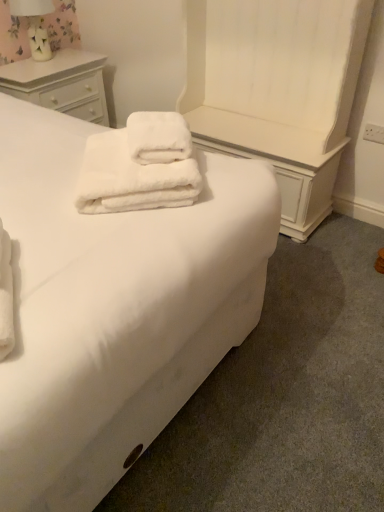
Describe the element at coordinates (35, 25) in the screenshot. I see `floral fabric lampshade at upper left` at that location.

Locate an element on the screen. The height and width of the screenshot is (512, 384). floral fabric lampshade at upper left is located at coordinates point(35,25).

At what (x,y) coordinates should I click in order to perform the action: click on white soft bed at center. Please return your answer as a coordinate pair (x, y). The width and height of the screenshot is (384, 512). Looking at the image, I should click on (114, 308).

Looking at this image, considering the relative positions of white fluffy towels at center and white soft bed at center in the image provided, is white fluffy towels at center to the left or to the right of white soft bed at center?

From the image, it's evident that white fluffy towels at center is to the right of white soft bed at center.

From the image's perspective, which object appears higher, white fluffy towels at center or white soft bed at center?

white fluffy towels at center.

Is white fluffy towels at center looking in the opposite direction of white soft bed at center?

Yes.

From a real-world perspective, is white fluffy towels at center physically located above or below white soft bed at center?

Clearly, from a real-world perspective, white fluffy towels at center is above white soft bed at center.

Can you confirm if white fluffy towels at center is positioned to the left of floral fabric lampshade at upper left?

No.

In the scene shown: Considering the sizes of objects white fluffy towels at center and floral fabric lampshade at upper left in the image provided, who is shorter, white fluffy towels at center or floral fabric lampshade at upper left?

With less height is white fluffy towels at center.

Between white fluffy towels at center and floral fabric lampshade at upper left, which one has larger size?

Bigger between the two is white fluffy towels at center.

Which is behind, white fluffy towels at center or floral fabric lampshade at upper left?

floral fabric lampshade at upper left is further away from the camera.

In the scene shown: Which is behind, white soft bed at center or floral fabric lampshade at upper left?

Positioned behind is floral fabric lampshade at upper left.

Considering the sizes of objects white soft bed at center and floral fabric lampshade at upper left in the image provided, who is bigger, white soft bed at center or floral fabric lampshade at upper left?

white soft bed at center is bigger.

Can you confirm if white soft bed at center is shorter than floral fabric lampshade at upper left?

No, white soft bed at center is not shorter than floral fabric lampshade at upper left.

Is floral fabric lampshade at upper left surrounded by white soft bed at center?

No, floral fabric lampshade at upper left is not inside white soft bed at center.

Is floral fabric lampshade at upper left facing towards white soft bed at center?

No, floral fabric lampshade at upper left is not turned towards white soft bed at center.

Which is nearer, (x=31, y=4) or (x=113, y=219)?

Point (x=31, y=4) is positioned farther from the camera compared to point (x=113, y=219).

From a real-world perspective, is floral fabric lampshade at upper left on white soft bed at center?

Yes, from a real-world perspective, floral fabric lampshade at upper left is above white soft bed at center.

Is floral fabric lampshade at upper left shorter than white soft bed at center?

Correct, floral fabric lampshade at upper left is not as tall as white soft bed at center.

Is white wood chest of drawers at upper left aimed at white soft bed at center?

No, white wood chest of drawers at upper left is not facing towards white soft bed at center.

Which is correct: white wood chest of drawers at upper left is inside white soft bed at center, or outside of it?

white wood chest of drawers at upper left is outside white soft bed at center.

Is point (67, 112) more distant than point (213, 222)?

Yes.

Locate an element on the screen. The image size is (384, 512). bed above the white wood chest of drawers at upper left (from a real-world perspective) is located at coordinates (114, 308).

Considering the relative positions of white soft bed at center and white fluffy towels at center in the image provided, is white soft bed at center behind white fluffy towels at center?

No, white soft bed at center is in front of white fluffy towels at center.

Is white soft bed at center touching white fluffy towels at center?

No, white soft bed at center is not making contact with white fluffy towels at center.

Based on the photo, from a real-world perspective, is white soft bed at center under white fluffy towels at center?

Yes, from a real-world perspective, white soft bed at center is below white fluffy towels at center.

Is white soft bed at center smaller than white fluffy towels at center?

No.

Is white wood chest of drawers at upper left further to the viewer compared to floral fabric lampshade at upper left?

No, the depth of white wood chest of drawers at upper left is less than that of floral fabric lampshade at upper left.

Which object is positioned more to the left, white wood chest of drawers at upper left or floral fabric lampshade at upper left?

floral fabric lampshade at upper left.

From a real-world perspective, between white wood chest of drawers at upper left and floral fabric lampshade at upper left, who is vertically lower?

white wood chest of drawers at upper left is physically lower.

Is white wood chest of drawers at upper left turned away from floral fabric lampshade at upper left?

No, white wood chest of drawers at upper left is not facing the opposite direction of floral fabric lampshade at upper left.

Identify the location of towel that appears behind the white soft bed at center. (131, 179).

Find the location of a particular element. bedside lamp that is above the white fluffy towels at center (from the image's perspective) is located at coordinates (35, 25).

From the image, which object appears to be nearer to white wood chest of drawers at upper left, floral fabric lampshade at upper left or white soft bed at center?

floral fabric lampshade at upper left.

Which object lies nearer to the anchor point floral fabric lampshade at upper left, white fluffy towels at center or white soft bed at center?

white fluffy towels at center.

Considering their positions, is white soft bed at center positioned further to white fluffy towels at center than white wood chest of drawers at upper left?

white wood chest of drawers at upper left lies further to white fluffy towels at center than the other object.

Looking at this image, considering their positions, is floral fabric lampshade at upper left positioned closer to white soft bed at center than white wood chest of drawers at upper left?

white wood chest of drawers at upper left is positioned closer to the anchor white soft bed at center.

Looking at this image, when comparing their distances from white fluffy towels at center, does floral fabric lampshade at upper left or white soft bed at center seem further?

floral fabric lampshade at upper left is positioned further to the anchor white fluffy towels at center.

Estimate the real-world distances between objects in this image. Which object is closer to white wood chest of drawers at upper left, white fluffy towels at center or white soft bed at center?

white soft bed at center lies closer to white wood chest of drawers at upper left than the other object.

Considering their positions, is white soft bed at center positioned closer to white wood chest of drawers at upper left than white fluffy towels at center?

white soft bed at center is closer to white wood chest of drawers at upper left.

Considering their positions, is floral fabric lampshade at upper left positioned closer to white fluffy towels at center than white wood chest of drawers at upper left?

white wood chest of drawers at upper left is positioned closer to the anchor white fluffy towels at center.

This screenshot has width=384, height=512. Find the location of `towel between white soft bed at center and white wood chest of drawers at upper left from front to back`. towel between white soft bed at center and white wood chest of drawers at upper left from front to back is located at coordinates (131, 179).

Where is `chest of drawers between white fluffy towels at center and floral fabric lampshade at upper left along the z-axis`? The image size is (384, 512). chest of drawers between white fluffy towels at center and floral fabric lampshade at upper left along the z-axis is located at coordinates (61, 83).

Locate an element on the screen. This screenshot has height=512, width=384. towel between white soft bed at center and floral fabric lampshade at upper left along the z-axis is located at coordinates (131, 179).

This screenshot has width=384, height=512. I want to click on the chest of drawers located between white soft bed at center and floral fabric lampshade at upper left in the depth direction, so click(61, 83).